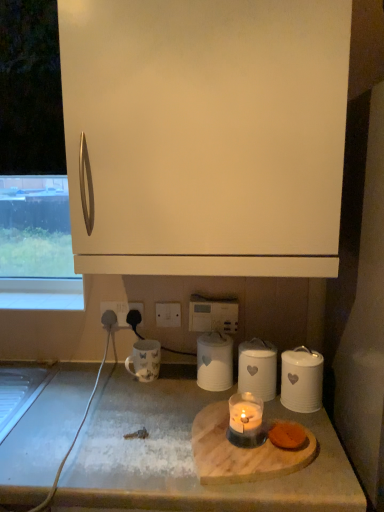
Question: Looking at the image, does translucent glass candle at center seem bigger or smaller compared to white ceramic canister at center, which appears as the 3th kitchen appliance when viewed from the right?

Choices:
 (A) small
 (B) big

Answer: (A)

Question: Visually, is translucent glass candle at center positioned to the left or to the right of white ceramic canister at center, positioned as the 1th kitchen appliance in left-to-right order?

Choices:
 (A) right
 (B) left

Answer: (A)

Question: Considering the real-world distances, which object is closest to the white matte cabinet at upper center?

Choices:
 (A) white rubber cable at lower left
 (B) white matte canister at center, the 2th kitchen appliance positioned from the right
 (C) white matte canister at lower right, which is the 1th kitchen appliance in right-to-left order
 (D) black plastic outlet at lower center
 (E) wooden cutting board at lower center

Answer: (B)

Question: Which object is the farthest from the black plastic outlet at lower center?

Choices:
 (A) white ceramic canister at center, positioned as the 1th kitchen appliance in left-to-right order
 (B) white matte canister at lower right, which is the 1th kitchen appliance in right-to-left order
 (C) white glossy mug at lower left
 (D) wooden cutting board at lower center
 (E) wooden cutting board at center

Answer: (E)